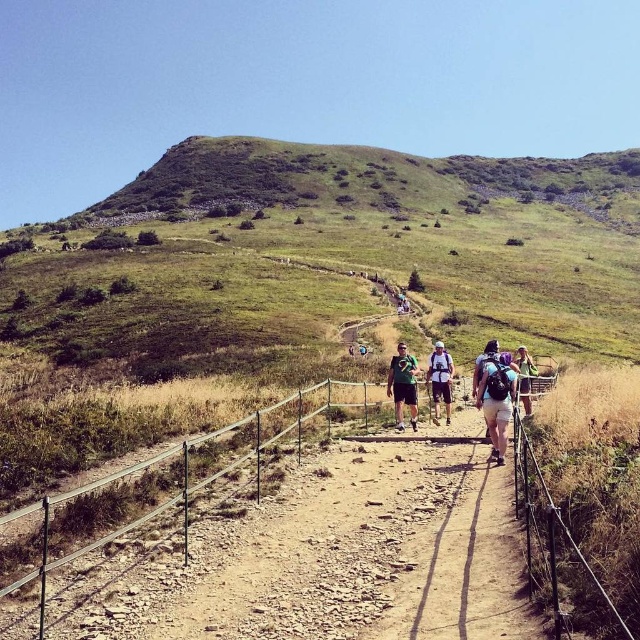
From the picture: Does matte purple backpack at center appear on the left side of white fabric backpack at center?

No, matte purple backpack at center is not to the left of white fabric backpack at center.

Based on the photo, is the position of matte purple backpack at center less distant than that of white fabric backpack at center?

Yes, it is.

The height and width of the screenshot is (640, 640). What do you see at coordinates (496, 397) in the screenshot?
I see `matte purple backpack at center` at bounding box center [496, 397].

You are a GUI agent. You are given a task and a screenshot of the screen. Output one action in this format:
    pyautogui.click(x=<x>, y=<y>)
    Task: Click on the matte purple backpack at center
    
    Given the screenshot: What is the action you would take?
    pyautogui.click(x=496, y=397)

Describe the element at coordinates (403, 385) in the screenshot. I see `green fabric shirt at center` at that location.

Looking at this image, between green fabric shirt at center and white fabric backpack at center, which one is positioned lower?

white fabric backpack at center is lower down.

Locate an element on the screen. Image resolution: width=640 pixels, height=640 pixels. green fabric shirt at center is located at coordinates (403, 385).

Identify the location of green fabric shirt at center. (403, 385).

Is green fabric shirt at center behind light blue fabric backpack at center-right?

Yes, green fabric shirt at center is behind light blue fabric backpack at center-right.

Describe the element at coordinates (403, 385) in the screenshot. The height and width of the screenshot is (640, 640). I see `green fabric shirt at center` at that location.

Where is `green fabric shirt at center`? green fabric shirt at center is located at coordinates (403, 385).